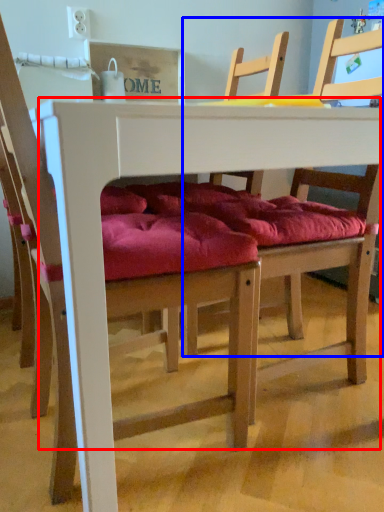
Question: Which point is further to the camera, table (highlighted by a red box) or chair (highlighted by a blue box)?

Choices:
 (A) table
 (B) chair

Answer: (B)